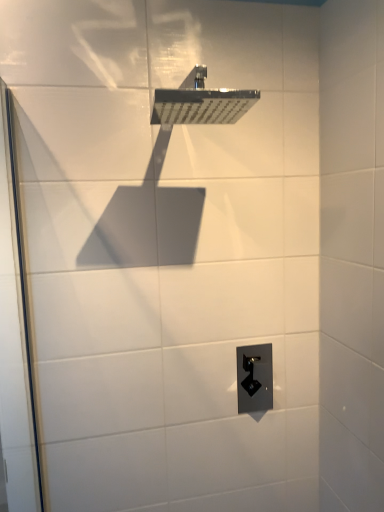
Question: Is polished chrome shower head at upper center next to black plastic outlet at lower center?

Choices:
 (A) no
 (B) yes

Answer: (A)

Question: From the image's perspective, is polished chrome shower head at upper center located above black plastic outlet at lower center?

Choices:
 (A) no
 (B) yes

Answer: (B)

Question: Does polished chrome shower head at upper center turn towards black plastic outlet at lower center?

Choices:
 (A) no
 (B) yes

Answer: (A)

Question: From a real-world perspective, is polished chrome shower head at upper center physically below black plastic outlet at lower center?

Choices:
 (A) yes
 (B) no

Answer: (B)

Question: Can black plastic outlet at lower center be found inside polished chrome shower head at upper center?

Choices:
 (A) no
 (B) yes

Answer: (A)

Question: Considering the positions of transparent glass screen door at left and black plastic outlet at lower center in the image, is transparent glass screen door at left taller or shorter than black plastic outlet at lower center?

Choices:
 (A) short
 (B) tall

Answer: (B)

Question: Based on their positions, is transparent glass screen door at left located to the left or right of black plastic outlet at lower center?

Choices:
 (A) right
 (B) left

Answer: (B)

Question: Relative to black plastic outlet at lower center, is transparent glass screen door at left in front or behind?

Choices:
 (A) behind
 (B) front

Answer: (B)

Question: From a real-world perspective, is transparent glass screen door at left positioned above or below black plastic outlet at lower center?

Choices:
 (A) above
 (B) below

Answer: (A)

Question: Visually, is transparent glass screen door at left positioned to the left or to the right of polished chrome shower head at upper center?

Choices:
 (A) right
 (B) left

Answer: (B)

Question: Is transparent glass screen door at left in front of or behind polished chrome shower head at upper center in the image?

Choices:
 (A) front
 (B) behind

Answer: (A)

Question: From the image's perspective, relative to polished chrome shower head at upper center, is transparent glass screen door at left above or below?

Choices:
 (A) above
 (B) below

Answer: (B)

Question: Is point (16, 224) closer or farther from the camera than point (201, 96)?

Choices:
 (A) farther
 (B) closer

Answer: (A)

Question: In the image, is black plastic outlet at lower center positioned in front of or behind polished chrome shower head at upper center?

Choices:
 (A) front
 (B) behind

Answer: (B)

Question: From a real-world perspective, is black plastic outlet at lower center above or below polished chrome shower head at upper center?

Choices:
 (A) above
 (B) below

Answer: (B)